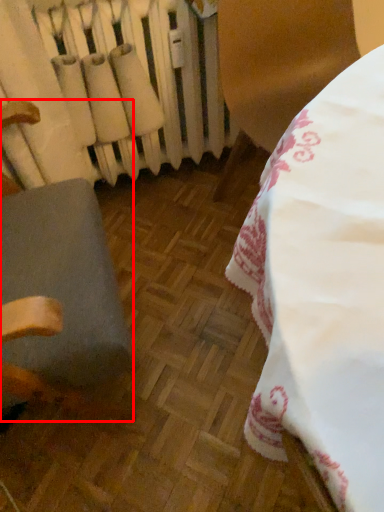
Question: In this image, where is furniture (annotated by the red box) located relative to radiator?

Choices:
 (A) right
 (B) left

Answer: (B)